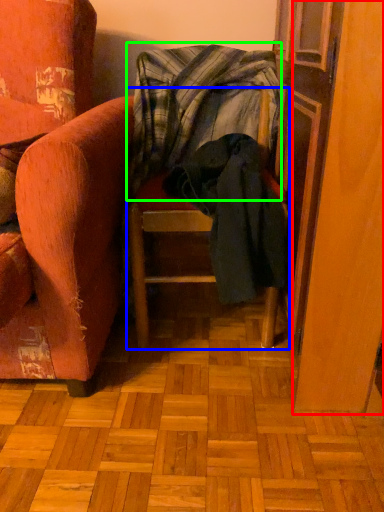
Question: Estimate the real-world distances between objects in this image. Which object is closer to screen door (highlighted by a red box), furniture (highlighted by a blue box) or blanket (highlighted by a green box)?

Choices:
 (A) furniture
 (B) blanket

Answer: (A)